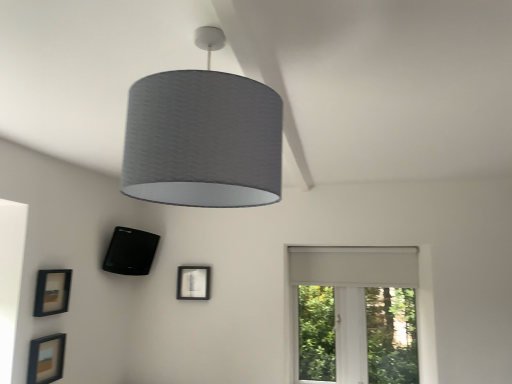
Question: From a real-world perspective, relative to black matte speaker at lower left, the first picture frame viewed from the back, is matte black picture frame at lower left, the 3th picture frame viewed from the back, vertically above or below?

Choices:
 (A) below
 (B) above

Answer: (A)

Question: Is matte black picture frame at lower left, the third picture frame from the right, taller or shorter than black matte speaker at lower left, acting as the first picture frame starting from the right?

Choices:
 (A) short
 (B) tall

Answer: (A)

Question: Which is farther from the textured gray lampshade at center?

Choices:
 (A) matte black picture frame at lower left, marked as the 2th picture frame in a left-to-right arrangement
 (B) black matte speaker at lower left, which ranks as the third picture frame in front-to-back order
 (C) matte black picture frame at lower left, the third picture frame from the right
 (D) white matte window at right

Answer: (D)

Question: Which is farther from the matte black picture frame at lower left, marked as the 2th picture frame in a left-to-right arrangement?

Choices:
 (A) matte black picture frame at lower left, the third picture frame from the right
 (B) white matte window at right
 (C) black matte speaker at lower left, the first picture frame viewed from the back
 (D) textured gray lampshade at center

Answer: (B)